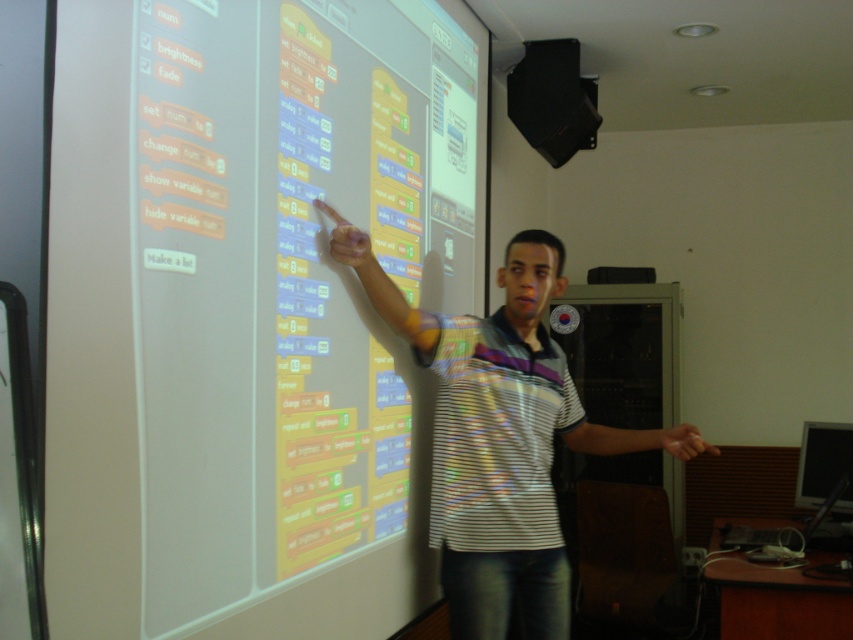
Is white matte projection screen at upper left below white striped shirt at center?

No, white matte projection screen at upper left is not below white striped shirt at center.

Which of these two, white matte projection screen at upper left or white striped shirt at center, stands shorter?

white striped shirt at center is shorter.

Measure the distance between white matte projection screen at upper left and camera.

They are 1.15 meters apart.

You are a GUI agent. You are given a task and a screenshot of the screen. Output one action in this format:
    pyautogui.click(x=<x>, y=<y>)
    Task: Click on the white matte projection screen at upper left
    This screenshot has width=853, height=640.
    Given the screenshot: What is the action you would take?
    pyautogui.click(x=248, y=308)

Between matte yellow finger at upper center and smooth skin hand at center, which one is positioned lower?

smooth skin hand at center

In the scene shown: Does matte yellow finger at upper center have a greater height compared to smooth skin hand at center?

Correct, matte yellow finger at upper center is much taller as smooth skin hand at center.

The height and width of the screenshot is (640, 853). What are the coordinates of `matte yellow finger at upper center` in the screenshot? It's located at (347, 243).

The height and width of the screenshot is (640, 853). I want to click on matte yellow finger at upper center, so click(347, 243).

Where is `white striped shirt at center`? The width and height of the screenshot is (853, 640). white striped shirt at center is located at coordinates (502, 444).

Does white striped shirt at center have a greater width compared to matte yellow finger at upper center?

Yes, white striped shirt at center is wider than matte yellow finger at upper center.

Does point (543, 532) come closer to viewer compared to point (337, 248)?

No, (543, 532) is further to viewer.

Locate an element on the screen. white striped shirt at center is located at coordinates (502, 444).